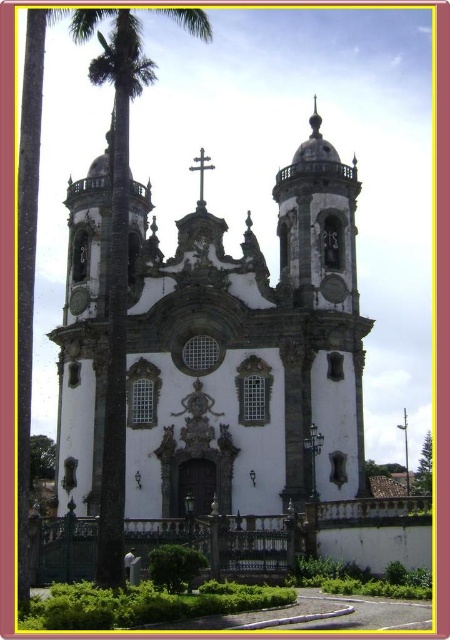
Is white stone church at center thinner than green leafy palm tree at left?

In fact, white stone church at center might be wider than green leafy palm tree at left.

Is white stone church at center wider than green leafy palm tree at left?

Yes.

Does point (99, 420) come closer to viewer compared to point (108, 481)?

No.

At what (x,y) coordinates should I click in order to perform the action: click on white stone church at center. Please return your answer as a coordinate pair (x, y). This screenshot has height=640, width=450. Looking at the image, I should click on (247, 353).

From the picture: Who is more distant from viewer, (162, 304) or (189, 166)?

Point (189, 166)

Which of these two, white stone church at center or metallic cross at center, stands shorter?

metallic cross at center is shorter.

I want to click on white stone church at center, so click(247, 353).

You are a GUI agent. You are given a task and a screenshot of the screen. Output one action in this format:
    pyautogui.click(x=<x>, y=<y>)
    Task: Click on the white stone church at center
    This screenshot has width=450, height=640.
    Given the screenshot: What is the action you would take?
    pyautogui.click(x=247, y=353)

What do you see at coordinates (117, 280) in the screenshot? I see `green leafy palm tree at left` at bounding box center [117, 280].

Is point (107, 500) positioned in front of point (199, 156)?

Yes, point (107, 500) is closer to viewer.

Is point (112, 237) positioned in front of point (199, 168)?

That is True.

This screenshot has width=450, height=640. Find the location of `green leafy palm tree at left`. green leafy palm tree at left is located at coordinates (117, 280).